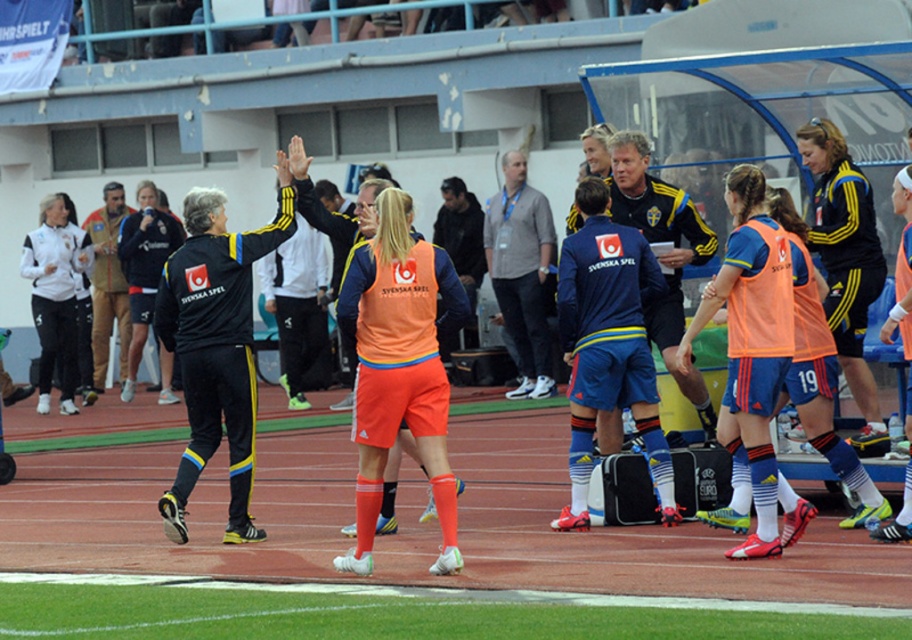
What do you see at coordinates (412, 550) in the screenshot? The width and height of the screenshot is (912, 640). I see `green turf at lower center` at bounding box center [412, 550].

In the scene shown: Does green turf at lower center appear on the left side of matte blue shorts at center?

Yes, green turf at lower center is to the left of matte blue shorts at center.

Does point (275, 541) come behind point (645, 205)?

No, (275, 541) is closer to viewer.

The image size is (912, 640). I want to click on green turf at lower center, so click(x=412, y=550).

Is point (682, 196) closer to viewer compared to point (105, 291)?

Yes.

Identify the location of matte blue shorts at center. The image size is (912, 640). (658, 241).

Who is positioned more to the left, green turf at lower center or brown leather jacket at left?

brown leather jacket at left is more to the left.

Can you confirm if green turf at lower center is smaller than brown leather jacket at left?

No, green turf at lower center is not smaller than brown leather jacket at left.

Is point (52, 554) positioned in front of point (110, 209)?

Yes, it is.

Find the location of a particular element. green turf at lower center is located at coordinates (412, 550).